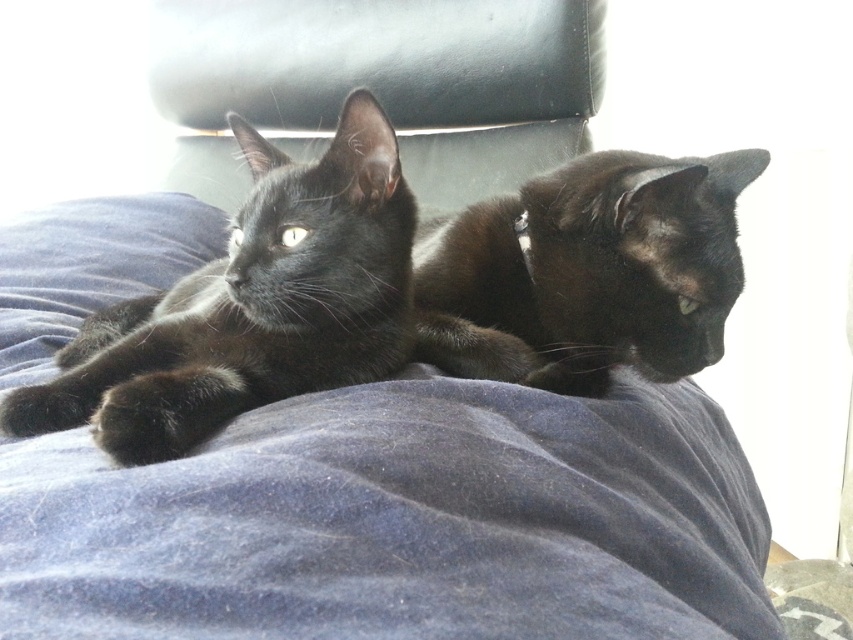
Is matte black cat at left to the right of shiny black cat at center from the viewer's perspective?

No, matte black cat at left is not to the right of shiny black cat at center.

Does matte black cat at left lie in front of shiny black cat at center?

Yes, matte black cat at left is in front of shiny black cat at center.

Who is more distant from viewer, [233,294] or [518,192]?

Point [518,192]

Image resolution: width=853 pixels, height=640 pixels. I want to click on matte black cat at left, so click(251, 305).

Which is in front, point (508, 508) or point (85, 416)?

Point (508, 508) is more forward.

Consider the image. Does velvety blue blanket at center appear over matte black cat at left?

Incorrect, velvety blue blanket at center is not positioned above matte black cat at left.

Identify the location of velvety blue blanket at center. click(399, 522).

Can you confirm if velvety blue blanket at center is taller than shiny black cat at center?

Indeed, velvety blue blanket at center has a greater height compared to shiny black cat at center.

Can you confirm if velvety blue blanket at center is positioned to the left of shiny black cat at center?

Correct, you'll find velvety blue blanket at center to the left of shiny black cat at center.

The width and height of the screenshot is (853, 640). I want to click on velvety blue blanket at center, so click(x=399, y=522).